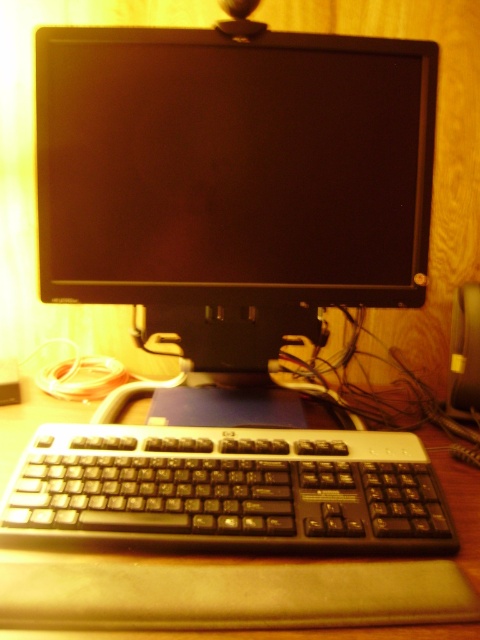
Does black matte monitor at center appear under brown wooden table at center?

No, black matte monitor at center is not below brown wooden table at center.

Does black matte monitor at center have a smaller size compared to brown wooden table at center?

Indeed, black matte monitor at center has a smaller size compared to brown wooden table at center.

The height and width of the screenshot is (640, 480). I want to click on black matte monitor at center, so click(232, 166).

Does black plastic keyboard at lower center have a greater width compared to brown wooden table at center?

No, black plastic keyboard at lower center is not wider than brown wooden table at center.

Between point (285, 486) and point (290, 628), which one is positioned in front?

Point (290, 628)

What are the coordinates of `black plastic keyboard at lower center` in the screenshot? It's located at (227, 490).

Can you confirm if black matte monitor at center is bigger than black plastic keyboard at lower center?

Yes.

Is point (379, 212) positioned before point (57, 513)?

No, (379, 212) is further to viewer.

Identify the location of black matte monitor at center. (232, 166).